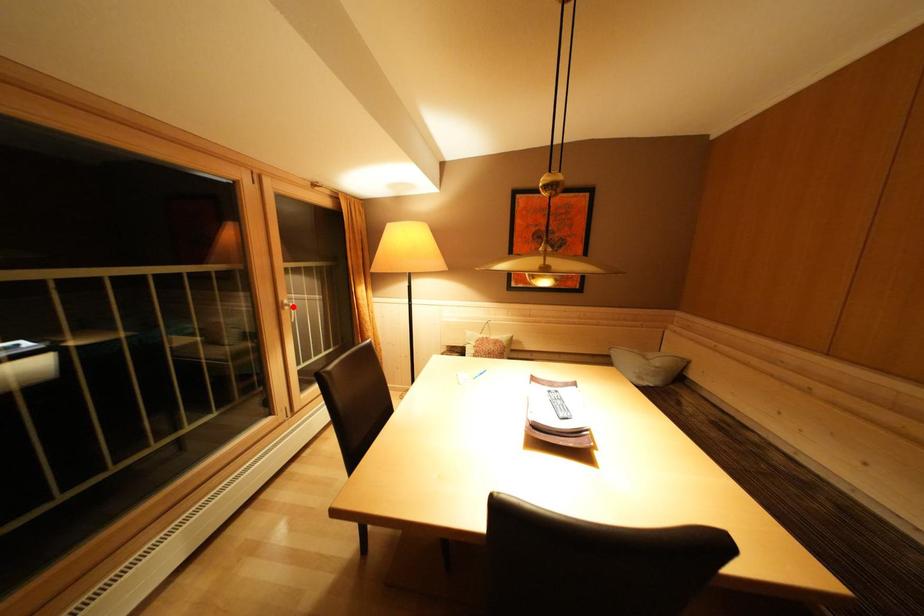
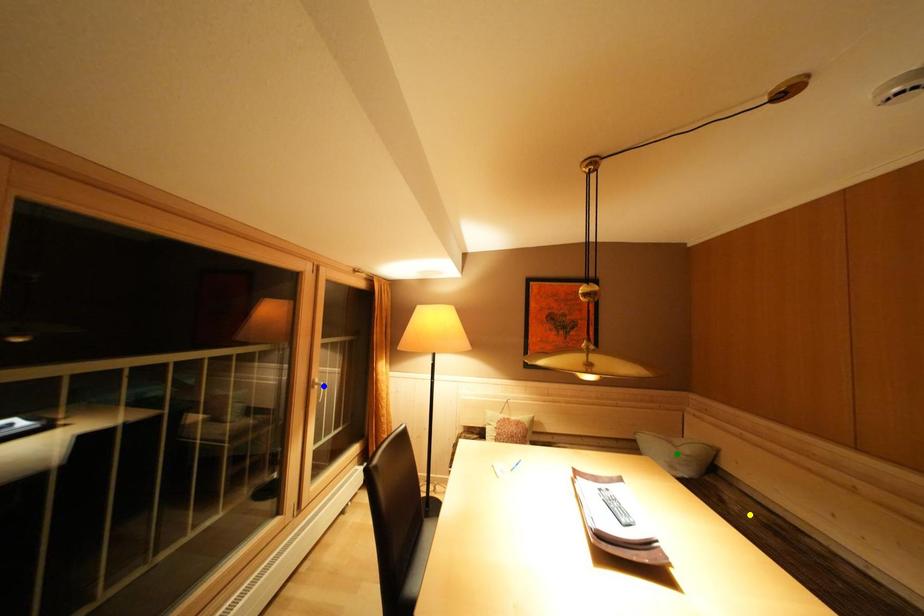
Question: I am providing you with two images of the same scene from different viewpoints. A red point is marked on the first image. You are given multiple points on the second image. In image 2, which mark is for the same physical point as the one in image 1?

Choices:
 (A) yellow point
 (B) green point
 (C) blue point

Answer: (C)